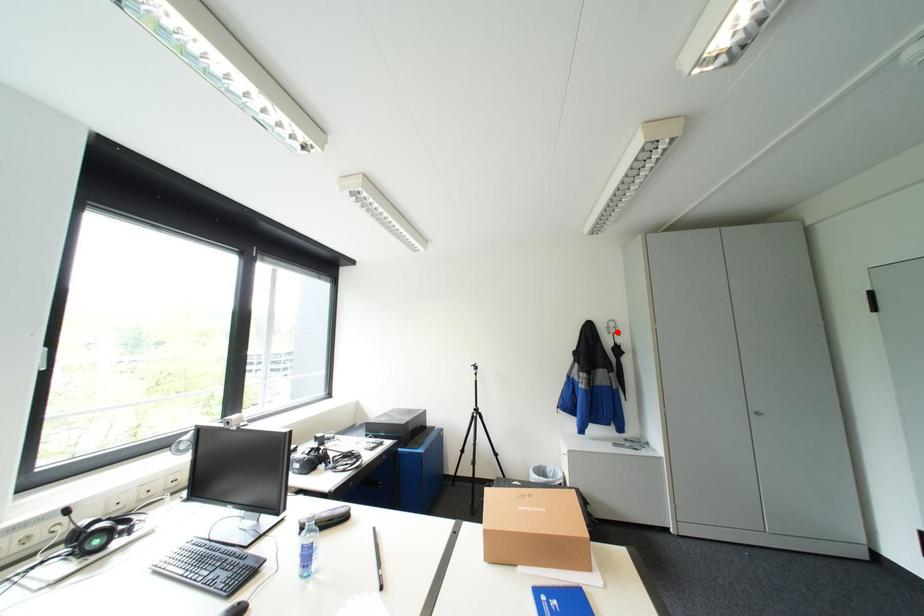
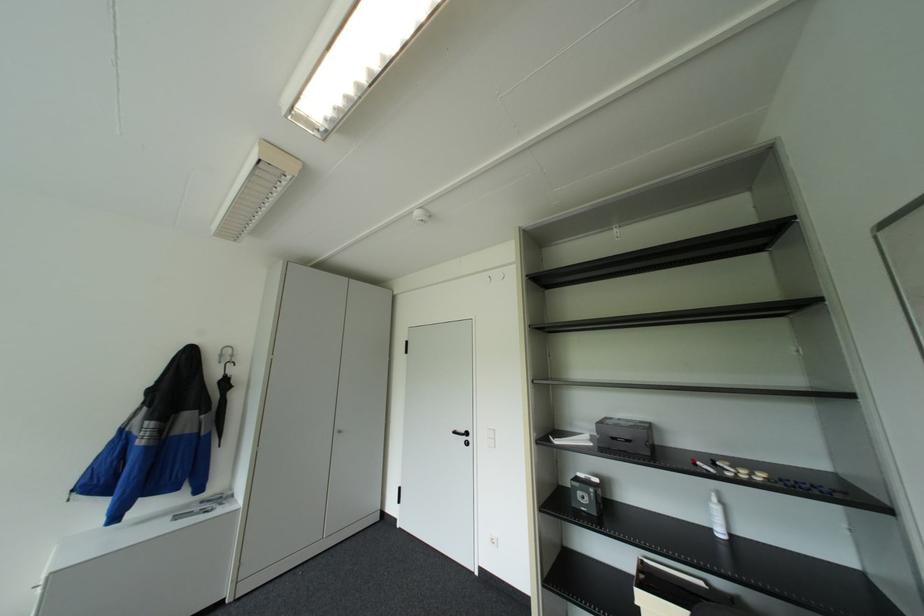
Find the pixel in the second image that matches the highlighted location in the first image.

(227, 361)